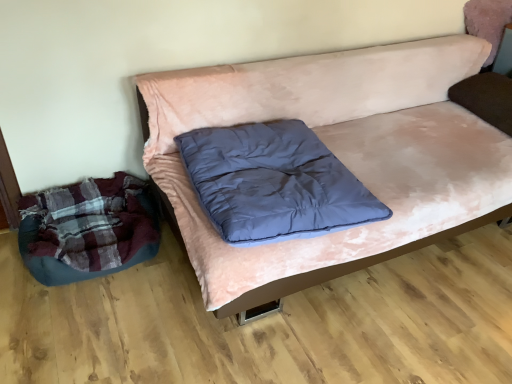
I want to click on vacant space in between pink velvety couch at center and plush dark blue bean bag at lower left, so click(x=135, y=306).